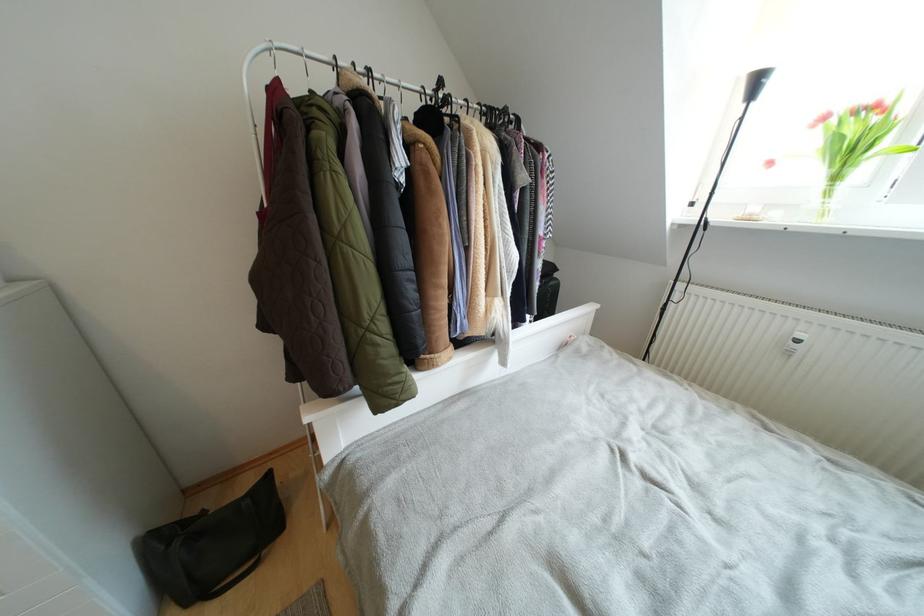
I want to click on radiator thermostat knob, so click(x=795, y=342).